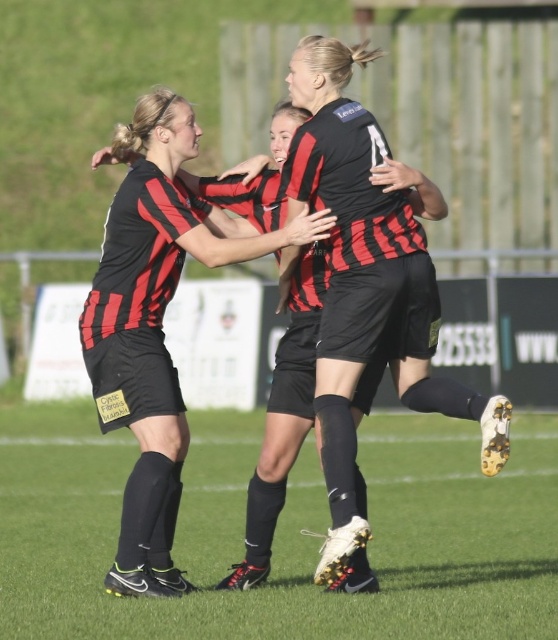
Does black synthetic football boot at lower center have a greater height compared to matte black soccer uniform at center?

Incorrect, black synthetic football boot at lower center's height is not larger of matte black soccer uniform at center's.

Between black synthetic football boot at lower center and matte black soccer uniform at center, which one has less height?

black synthetic football boot at lower center

Does point (550, 573) lie behind point (344, 408)?

That is True.

The image size is (558, 640). Identify the location of black synthetic football boot at lower center. [x=282, y=532].